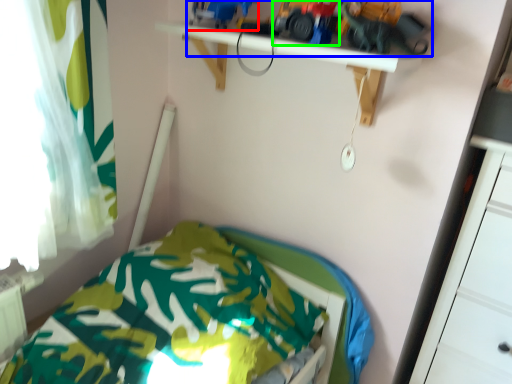
Question: Considering the real-world distances, which object is closest to toy (highlighted by a red box)? toy (highlighted by a blue box) or toy car (highlighted by a green box).

Choices:
 (A) toy
 (B) toy car

Answer: (A)